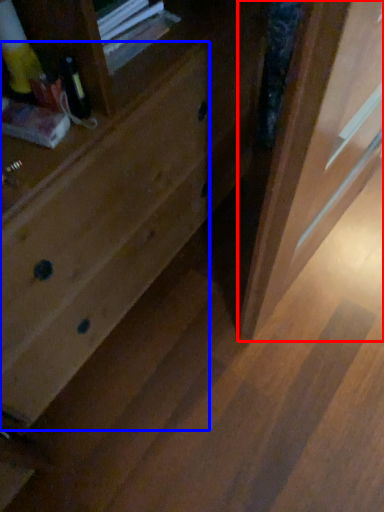
Question: Which object appears closest to the camera in this image, screen door (highlighted by a red box) or drawer (highlighted by a blue box)?

Choices:
 (A) screen door
 (B) drawer

Answer: (B)